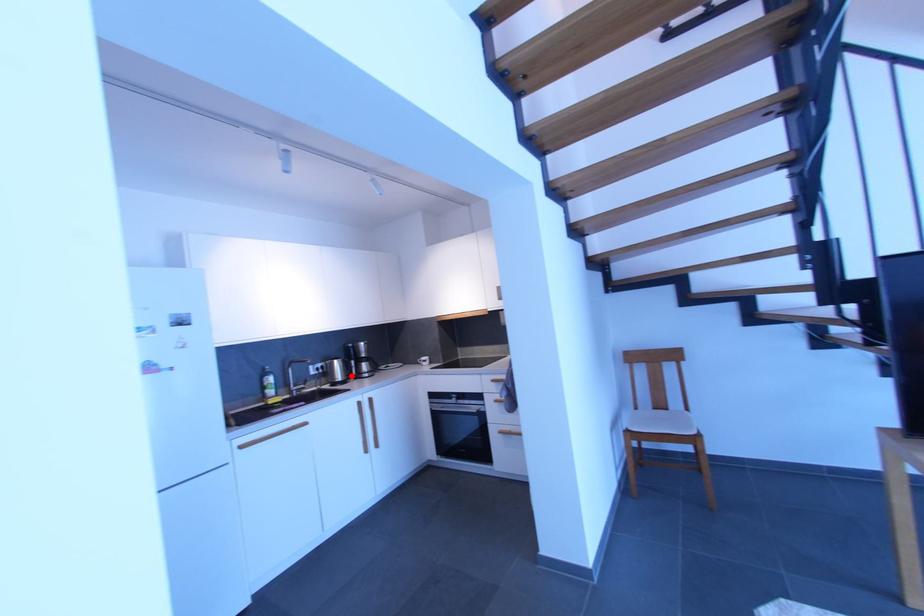
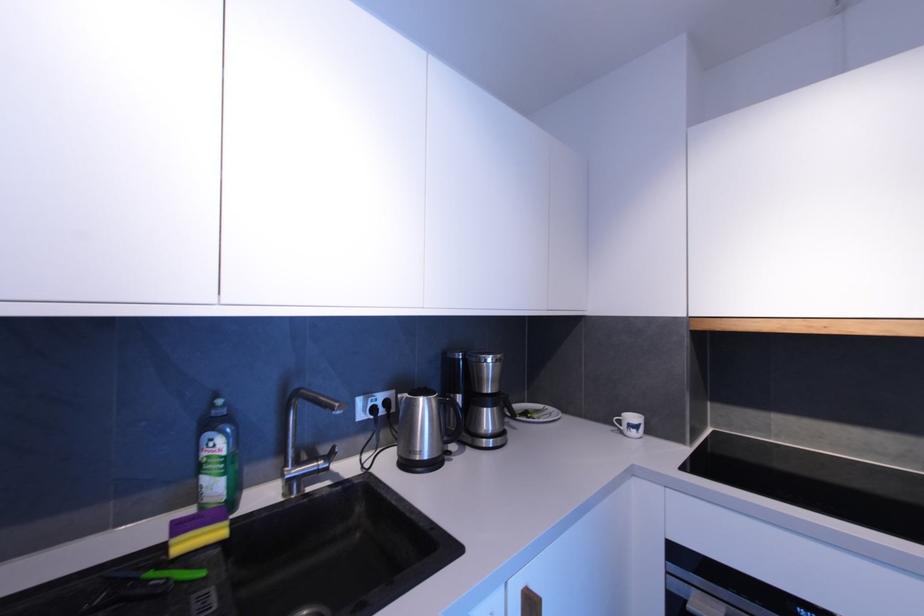
In the second image, find the point that corresponds to the highlighted location in the first image.

(450, 440)